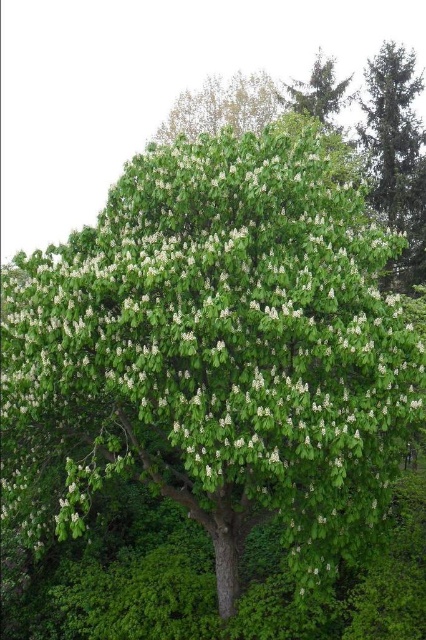
Can you confirm if green matte tree at upper right is thinner than green leafy tree at upper center?

Correct, green matte tree at upper right's width is less than green leafy tree at upper center's.

Which is above, green matte tree at upper right or green leafy tree at upper center?

green leafy tree at upper center is above.

Is point (425, 252) behind point (186, 129)?

That is False.

Identify the location of green matte tree at upper right. (397, 152).